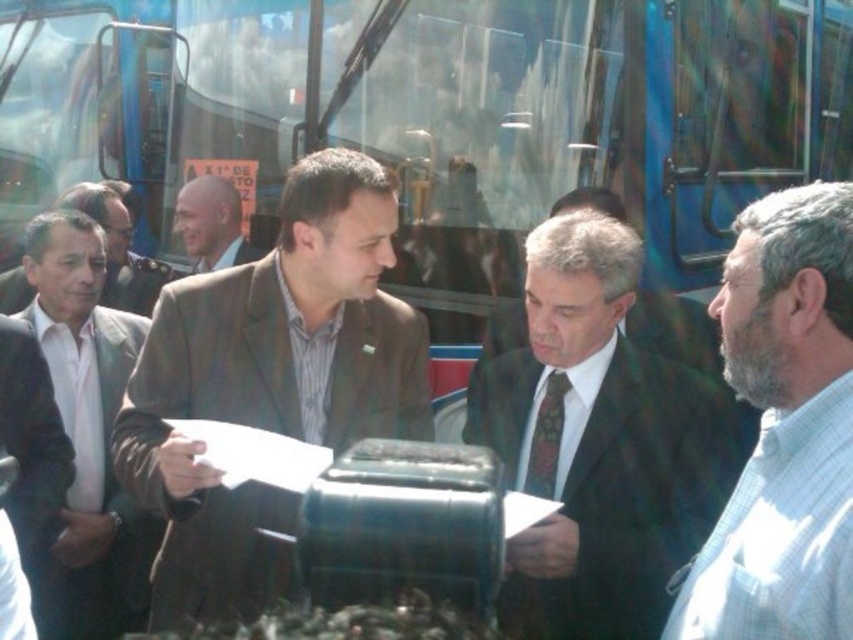
Is dark suit at center wider than matte brown suit at left?

Indeed, dark suit at center has a greater width compared to matte brown suit at left.

Which is behind, point (613, 598) or point (126, 225)?

The point (126, 225) is more distant.

Does point (498, 442) lie behind point (136, 260)?

That is False.

Find the location of `dark suit at center`. dark suit at center is located at coordinates (598, 442).

Does point (300, 234) lie behind point (233, 244)?

No, it is not.

Between point (373, 406) and point (239, 244), which one is positioned in front?

Point (373, 406)

The height and width of the screenshot is (640, 853). I want to click on brown textured suit at center, so click(270, 381).

Between point (70, 502) and point (196, 234), which one is positioned in front?

Point (70, 502) is in front.

Looking at this image, measure the distance between white matte suit at left and light brown textured jacket at center.

A distance of 4.17 feet exists between white matte suit at left and light brown textured jacket at center.

Which is behind, point (114, 515) or point (239, 220)?

Point (239, 220)

Image resolution: width=853 pixels, height=640 pixels. What are the coordinates of `white matte suit at left` in the screenshot? It's located at (86, 435).